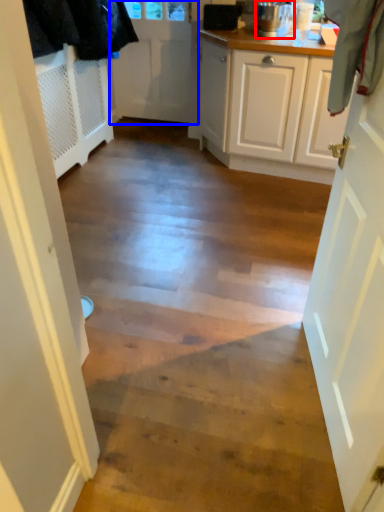
Question: Among these objects, which one is nearest to the camera, kitchen appliance (highlighted by a red box) or door (highlighted by a blue box)?

Choices:
 (A) kitchen appliance
 (B) door

Answer: (A)